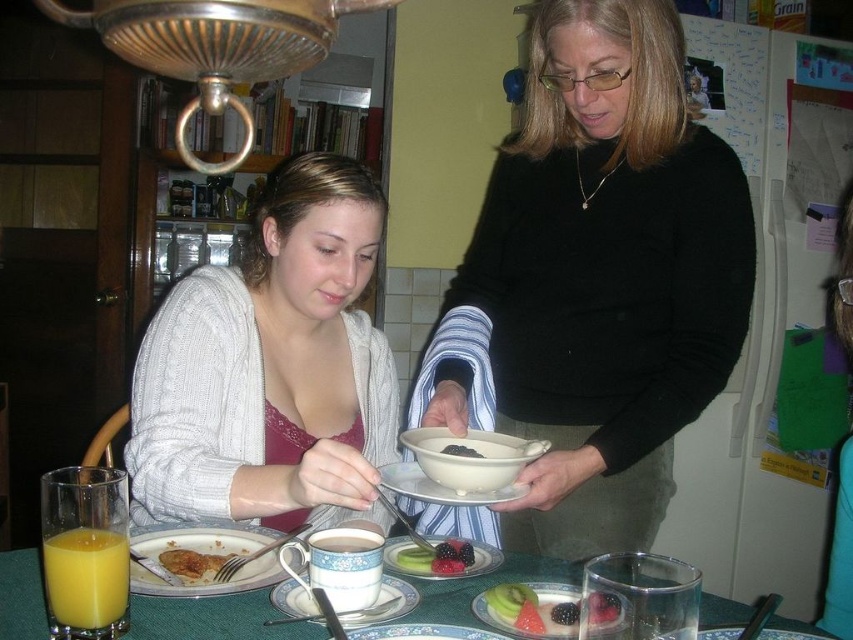
You are a guest at this meal and want to reach for the fruit on the porcelain plate with fruit at center. However, there is another porcelain plate at center in the way. Can you easily access the fruit plate without moving the other plate?

The porcelain plate with fruit at center is behind the porcelain plate at center, so you cannot easily access it without moving the other plate.

Consider the image. You are a guest at this meal and want to reach for the porcelain cup at center without knocking over the matte ceramic plate at center. Is this possible?

The porcelain cup at center is positioned over matte ceramic plate at center, so you can safely reach for the porcelain cup at center without disturbing the plate since it is already placed on top of it.